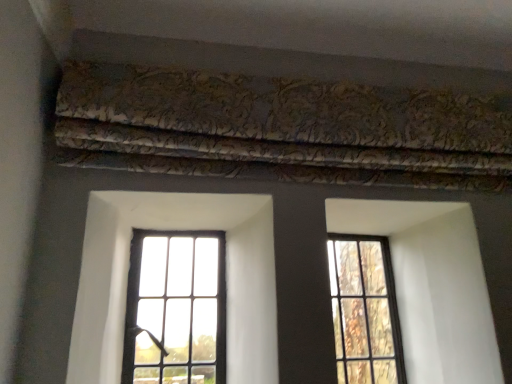
Question: From a real-world perspective, is clear glass window at center, which is counted as the 1th window, starting from the left, under clear glass window at right, the first window when ordered from right to left?

Choices:
 (A) yes
 (B) no

Answer: (B)

Question: Is clear glass window at center, which is counted as the 1th window, starting from the left, with clear glass window at right, acting as the 2th window starting from the left?

Choices:
 (A) no
 (B) yes

Answer: (A)

Question: Is the depth of clear glass window at center, which is counted as the 1th window, starting from the left, less than that of clear glass window at right, acting as the 2th window starting from the left?

Choices:
 (A) no
 (B) yes

Answer: (B)

Question: Considering the relative sizes of clear glass window at center, which is counted as the 1th window, starting from the left, and clear glass window at right, acting as the 2th window starting from the left, in the image provided, is clear glass window at center, which is counted as the 1th window, starting from the left, bigger than clear glass window at right, acting as the 2th window starting from the left,?

Choices:
 (A) no
 (B) yes

Answer: (B)

Question: Does clear glass window at center, placed as the 2th window when sorted from right to left, have a greater height compared to clear glass window at right, acting as the 2th window starting from the left?

Choices:
 (A) no
 (B) yes

Answer: (A)

Question: Is clear glass window at center, placed as the 2th window when sorted from right to left, situated inside clear glass window at right, acting as the 2th window starting from the left, or outside?

Choices:
 (A) inside
 (B) outside

Answer: (B)

Question: Is point (153, 302) positioned closer to the camera than point (390, 374)?

Choices:
 (A) farther
 (B) closer

Answer: (B)

Question: From a real-world perspective, is clear glass window at center, which is counted as the 1th window, starting from the left, above or below clear glass window at right, acting as the 2th window starting from the left?

Choices:
 (A) above
 (B) below

Answer: (A)

Question: Is clear glass window at center, which is counted as the 1th window, starting from the left, bigger or smaller than clear glass window at right, the first window when ordered from right to left?

Choices:
 (A) big
 (B) small

Answer: (A)

Question: Visually, is clear glass window at right, acting as the 2th window starting from the left, positioned to the left or to the right of clear glass window at center, placed as the 2th window when sorted from right to left?

Choices:
 (A) left
 (B) right

Answer: (B)

Question: Considering the positions of clear glass window at right, acting as the 2th window starting from the left, and clear glass window at center, placed as the 2th window when sorted from right to left, in the image, is clear glass window at right, acting as the 2th window starting from the left, bigger or smaller than clear glass window at center, placed as the 2th window when sorted from right to left,?

Choices:
 (A) small
 (B) big

Answer: (A)

Question: Considering the positions of clear glass window at right, acting as the 2th window starting from the left, and clear glass window at center, placed as the 2th window when sorted from right to left, in the image, is clear glass window at right, acting as the 2th window starting from the left, taller or shorter than clear glass window at center, placed as the 2th window when sorted from right to left,?

Choices:
 (A) short
 (B) tall

Answer: (B)

Question: From a real-world perspective, is clear glass window at right, acting as the 2th window starting from the left, positioned above or below clear glass window at center, which is counted as the 1th window, starting from the left?

Choices:
 (A) below
 (B) above

Answer: (A)

Question: Relative to clear glass window at center, placed as the 2th window when sorted from right to left, is gold-patterned fabric at upper center in front or behind?

Choices:
 (A) front
 (B) behind

Answer: (A)

Question: From the image's perspective, is gold-patterned fabric at upper center located above or below clear glass window at center, placed as the 2th window when sorted from right to left?

Choices:
 (A) below
 (B) above

Answer: (B)